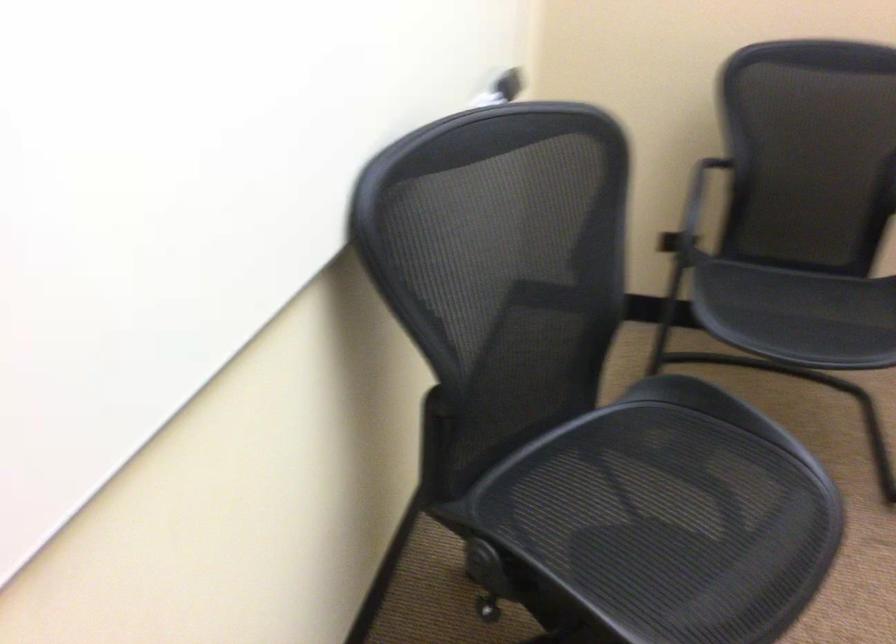
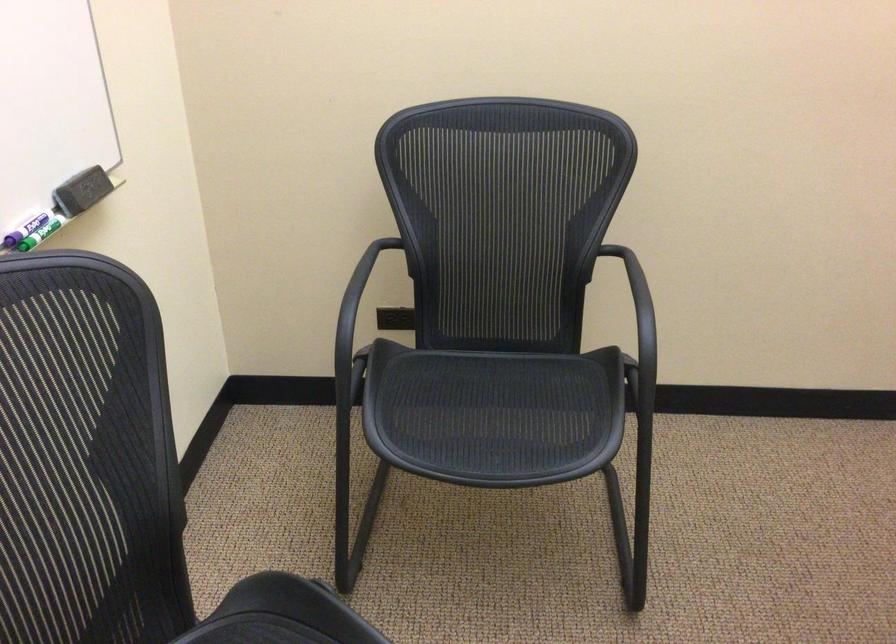
In the second image, find the point that corresponds to [698,176] in the first image.

(360, 286)